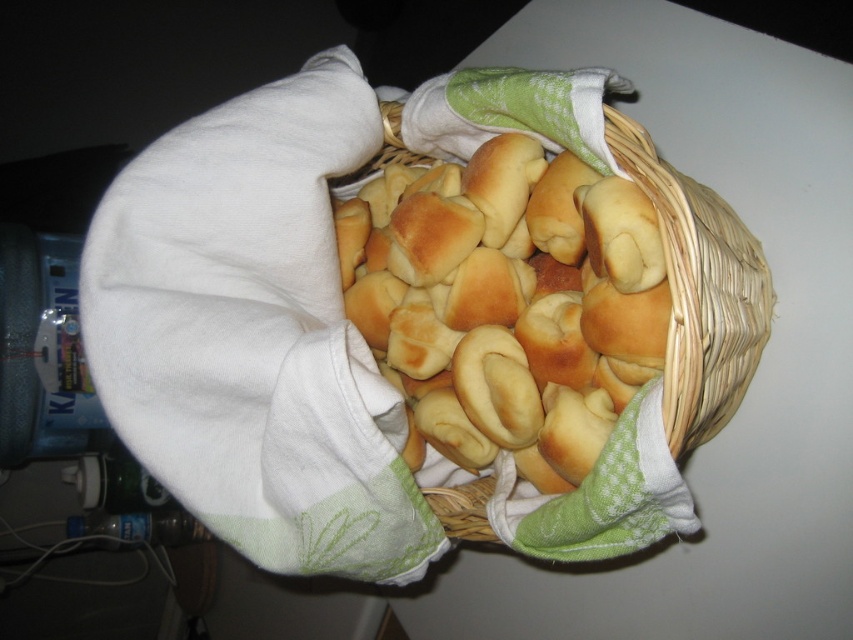
Question: Does white cotton cloth at upper left appear on the right side of woven straw basket at center?

Choices:
 (A) yes
 (B) no

Answer: (B)

Question: Among these objects, which one is farthest from the camera?

Choices:
 (A) woven straw basket at center
 (B) white cotton cloth at upper left

Answer: (B)

Question: Is white cotton cloth at upper left below woven straw basket at center?

Choices:
 (A) yes
 (B) no

Answer: (B)

Question: Considering the relative positions of white cotton cloth at upper left and woven straw basket at center in the image provided, where is white cotton cloth at upper left located with respect to woven straw basket at center?

Choices:
 (A) left
 (B) right

Answer: (A)